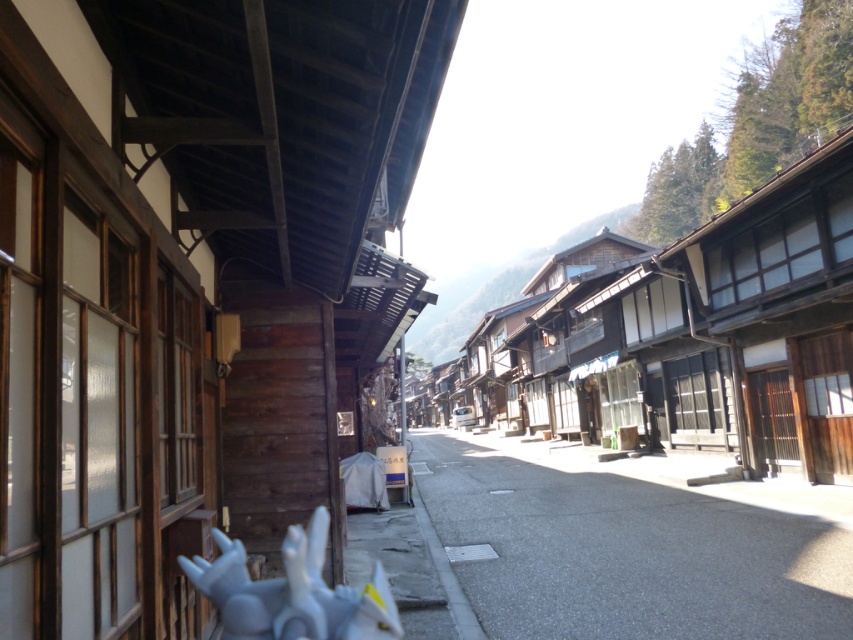
Based on the photo, you are a tourist standing on the street in the image and want to take a photo of both the wooden buildings at center and the white matte statue at lower center. Which object should you position closer to the left side of your camera frame to include both in the photo?

You should position the white matte statue at lower center closer to the left side of your camera frame because the wooden buildings at center is to the right of white matte statue at lower center.

You are a delivery person carrying a large package that requires a flat surface to place. You see the wooden buildings at center and the smooth concrete street at center. Which location would be more suitable for placing your package?

The smooth concrete street at center is more suitable for placing the package since it has a smooth surface, while the wooden buildings at center are larger in size but not a flat surface for placing items.

You are a delivery person with a cart that is 2 meters wide. You need to transport a large package from the wooden buildings at center to the smooth concrete street at center. Can your cart fit through the space between them?

The wooden buildings at center and smooth concrete street at center are 17.16 meters apart from each other. Since your cart is only 2 meters wide, it can easily fit through the space between them as the distance is more than sufficient.